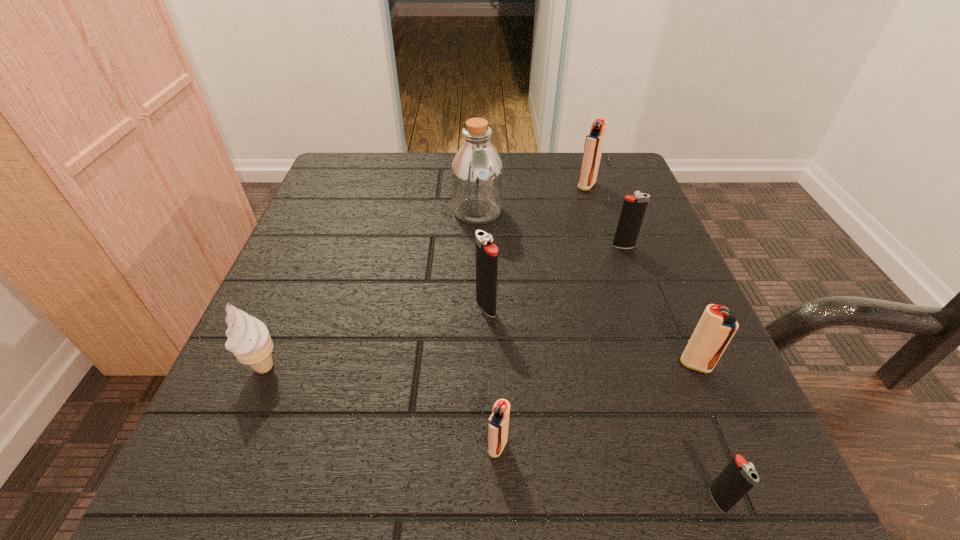
At what (x,y) coordinates should I click in order to perform the action: click on free point between the nearest black igniter and the farthest igniter. Please return your answer as a coordinate pair (x, y). Looking at the image, I should click on (652, 342).

Where is `vacant space that's between the biggest black igniter and the icecream`? Image resolution: width=960 pixels, height=540 pixels. vacant space that's between the biggest black igniter and the icecream is located at coordinates (375, 337).

Where is `vacant region between the icecream and the leftmost black igniter`? The width and height of the screenshot is (960, 540). vacant region between the icecream and the leftmost black igniter is located at coordinates (375, 337).

Identify which object is located as the sixth nearest to the fifth nearest object. Please provide its 2D coordinates. Your answer should be formatted as a tuple, i.e. [(x, y)], where the tuple contains the x and y coordinates of a point satisfying the conditions above.

[(738, 477)]

Locate which object ranks second in proximity to the second farthest object. Please provide its 2D coordinates. Your answer should be formatted as a tuple, i.e. [(x, y)], where the tuple contains the x and y coordinates of a point satisfying the conditions above.

[(486, 253)]

Locate which igniter is the fifth closest to the second farthest black igniter. Please provide its 2D coordinates. Your answer should be formatted as a tuple, i.e. [(x, y)], where the tuple contains the x and y coordinates of a point satisfying the conditions above.

[(594, 141)]

Select which igniter is the second closest to the second biggest black igniter. Please provide its 2D coordinates. Your answer should be formatted as a tuple, i.e. [(x, y)], where the tuple contains the x and y coordinates of a point satisfying the conditions above.

[(715, 329)]

Identify which red igniter is the third nearest to the nearest object. Please provide its 2D coordinates. Your answer should be formatted as a tuple, i.e. [(x, y)], where the tuple contains the x and y coordinates of a point satisfying the conditions above.

[(594, 141)]

Locate which red igniter is the second closest to the farthest object. Please provide its 2D coordinates. Your answer should be formatted as a tuple, i.e. [(x, y)], where the tuple contains the x and y coordinates of a point satisfying the conditions above.

[(498, 423)]

Identify the location of the second closest black igniter to the icecream. (738, 477).